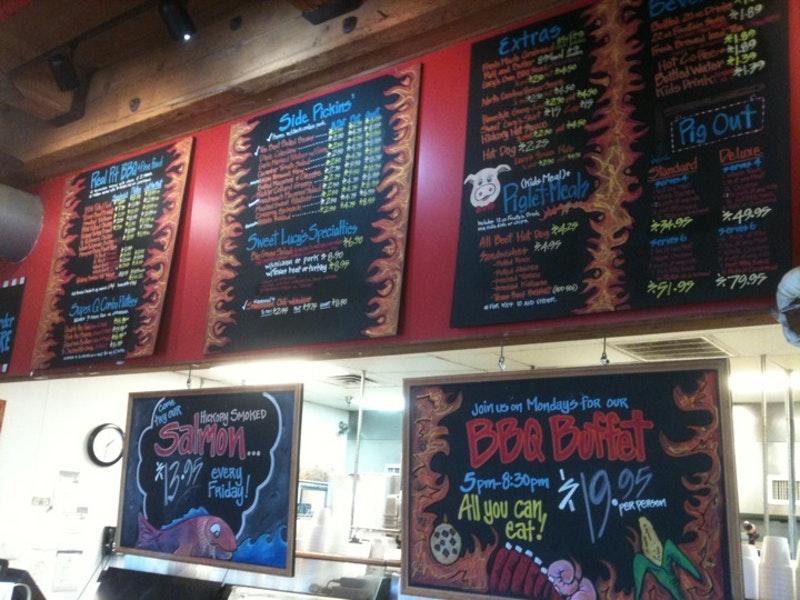
Locate an element on the screen. Image resolution: width=800 pixels, height=600 pixels. restaurant menus is located at coordinates (213, 462), (630, 488), (666, 217), (522, 155), (310, 155), (118, 233).